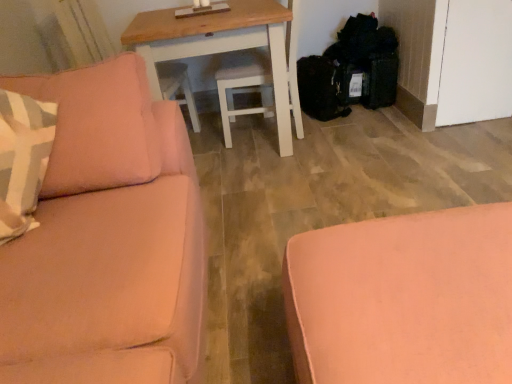
Question: Considering the relative sizes of wooden table at center and satin pink couch at left, which appears as the second studio couch when viewed from the right, in the image provided, is wooden table at center bigger than satin pink couch at left, which appears as the second studio couch when viewed from the right,?

Choices:
 (A) no
 (B) yes

Answer: (A)

Question: Is the surface of wooden table at center in direct contact with satin pink couch at left, which appears as the second studio couch when viewed from the right?

Choices:
 (A) no
 (B) yes

Answer: (A)

Question: Does wooden table at center have a lesser height compared to satin pink couch at left, marked as the first studio couch in a left-to-right arrangement?

Choices:
 (A) yes
 (B) no

Answer: (A)

Question: Is wooden table at center located outside satin pink couch at left, which appears as the second studio couch when viewed from the right?

Choices:
 (A) no
 (B) yes

Answer: (B)

Question: From the image's perspective, is wooden table at center beneath satin pink couch at left, marked as the first studio couch in a left-to-right arrangement?

Choices:
 (A) yes
 (B) no

Answer: (B)

Question: From the image's perspective, is pink fabric ottoman at lower right, acting as the second studio couch starting from the left, positioned above or below wooden table at center?

Choices:
 (A) above
 (B) below

Answer: (B)

Question: Is pink fabric ottoman at lower right, acting as the second studio couch starting from the left, in front of or behind wooden table at center in the image?

Choices:
 (A) front
 (B) behind

Answer: (A)

Question: Is pink fabric ottoman at lower right, acting as the second studio couch starting from the left, taller or shorter than wooden table at center?

Choices:
 (A) short
 (B) tall

Answer: (A)

Question: From a real-world perspective, is pink fabric ottoman at lower right, the first studio couch from the right, above or below wooden table at center?

Choices:
 (A) below
 (B) above

Answer: (A)

Question: Considering the positions of satin pink couch at left, marked as the first studio couch in a left-to-right arrangement, and pink fabric ottoman at lower right, acting as the second studio couch starting from the left, in the image, is satin pink couch at left, marked as the first studio couch in a left-to-right arrangement, wider or thinner than pink fabric ottoman at lower right, acting as the second studio couch starting from the left,?

Choices:
 (A) thin
 (B) wide

Answer: (A)

Question: Is satin pink couch at left, marked as the first studio couch in a left-to-right arrangement, bigger or smaller than pink fabric ottoman at lower right, acting as the second studio couch starting from the left?

Choices:
 (A) small
 (B) big

Answer: (B)

Question: Is point (20, 251) positioned closer to the camera than point (476, 302)?

Choices:
 (A) farther
 (B) closer

Answer: (A)

Question: From a real-world perspective, relative to pink fabric ottoman at lower right, the first studio couch from the right, is satin pink couch at left, marked as the first studio couch in a left-to-right arrangement, vertically above or below?

Choices:
 (A) above
 (B) below

Answer: (A)

Question: Is wooden table at center wider or thinner than pink fabric ottoman at lower right, the first studio couch from the right?

Choices:
 (A) thin
 (B) wide

Answer: (B)

Question: From a real-world perspective, is wooden table at center physically located above or below pink fabric ottoman at lower right, the first studio couch from the right?

Choices:
 (A) above
 (B) below

Answer: (A)